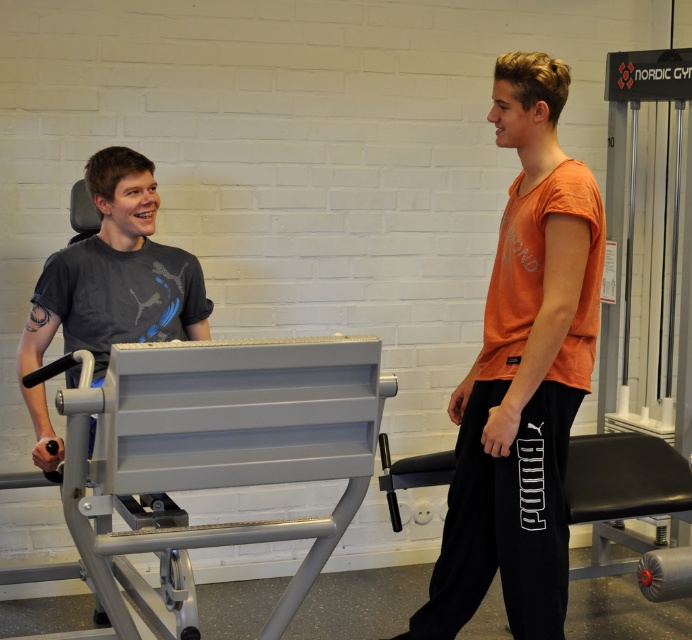
Which of these two, orange cotton t-shirt at right or matte black t-shirt at left, stands shorter?

matte black t-shirt at left is shorter.

Between orange cotton t-shirt at right and matte black t-shirt at left, which one appears on the right side from the viewer's perspective?

orange cotton t-shirt at right

Who is more distant from viewer, (448,602) or (143,218)?

The point (448,602) is more distant.

Where is `orange cotton t-shirt at right`? orange cotton t-shirt at right is located at coordinates (522, 374).